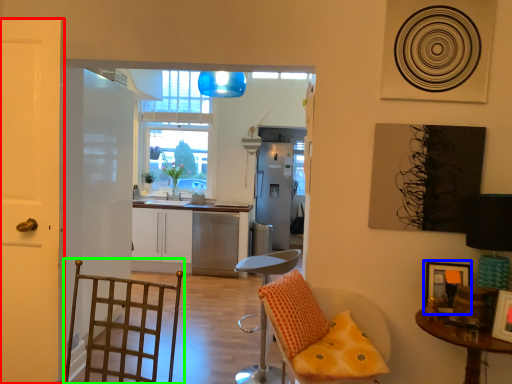
Question: Which object is the closest to the door (highlighted by a red box)? Choose among these: picture frame (highlighted by a blue box) or swivel chair (highlighted by a green box).

Choices:
 (A) picture frame
 (B) swivel chair

Answer: (B)